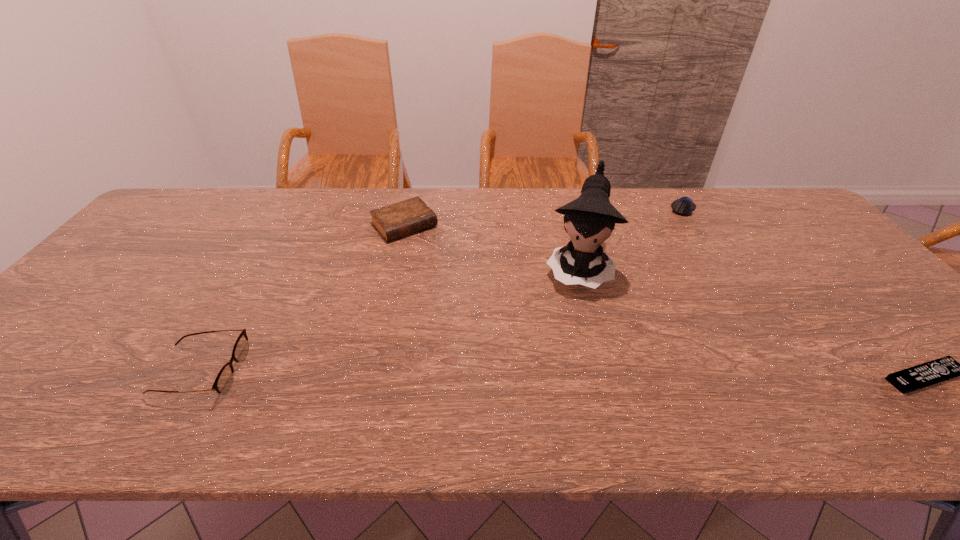
Identify the location of blank space located 0.180m on the spine side of the third tallest object. This screenshot has width=960, height=540. (449, 274).

Identify the location of vacant point located on the spine side of the third tallest object. (430, 253).

At what (x,y) coordinates should I click in order to perform the action: click on vacant space located 0.070m on the button side of the second shortest object. Please return your answer as a coordinate pair (x, y). Looking at the image, I should click on (674, 226).

What are the coordinates of `vacant space situated 0.100m on the button side of the second shortest object` in the screenshot? It's located at (671, 230).

The image size is (960, 540). In order to click on vacant space located 0.350m on the button side of the second shortest object in this screenshot , I will do `click(646, 274)`.

This screenshot has width=960, height=540. In order to click on free space located 0.080m at the face of the third object from right to left in this screenshot , I will do point(570,321).

At what (x,y) coordinates should I click in order to perform the action: click on free space located 0.160m at the face of the third object from right to left. Please return your answer as a coordinate pair (x, y). The image size is (960, 540). Looking at the image, I should click on (565, 345).

Image resolution: width=960 pixels, height=540 pixels. I want to click on vacant space situated 0.210m at the face of the third object from right to left, so click(x=563, y=362).

This screenshot has width=960, height=540. Find the location of `diary present at the far edge`. diary present at the far edge is located at coordinates (400, 219).

This screenshot has width=960, height=540. What are the coordinates of `computer mouse that is at the far edge` in the screenshot? It's located at (684, 206).